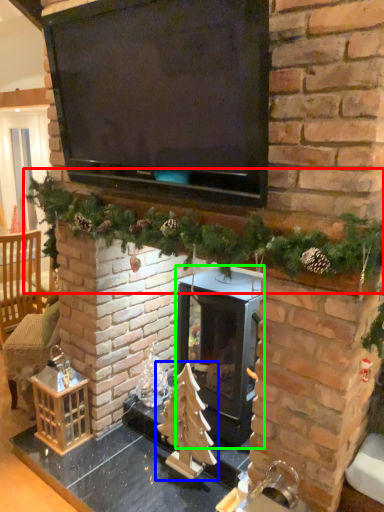
Question: Which is nearer to the christmas decoration (highlighted by a red box)? christmas tree (highlighted by a blue box) or wood burning stove (highlighted by a green box).

Choices:
 (A) christmas tree
 (B) wood burning stove

Answer: (B)